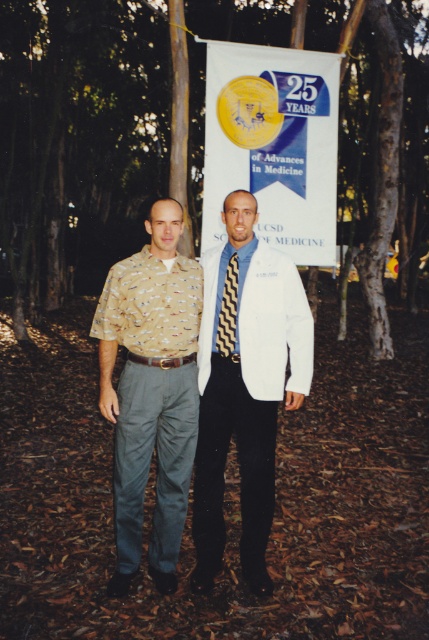
Can you confirm if camouflage shirt at left is smaller than black zigzag tie at center?

No.

Who is more distant from viewer, (166, 346) or (236, 259)?

The point (236, 259) is behind.

Where is `camouflage shirt at left`? camouflage shirt at left is located at coordinates (151, 392).

From the picture: Is white smooth coat at center thinner than camouflage shirt at left?

No, white smooth coat at center is not thinner than camouflage shirt at left.

This screenshot has width=429, height=640. In order to click on white smooth coat at center in this screenshot , I will do `click(244, 385)`.

Between brown bark tree at center and camouflage shirt at left, which one is positioned higher?

Positioned higher is brown bark tree at center.

Is point (416, 132) closer to camera compared to point (120, 566)?

No, it is behind (120, 566).

Locate an element on the screen. Image resolution: width=429 pixels, height=640 pixels. brown bark tree at center is located at coordinates (78, 141).